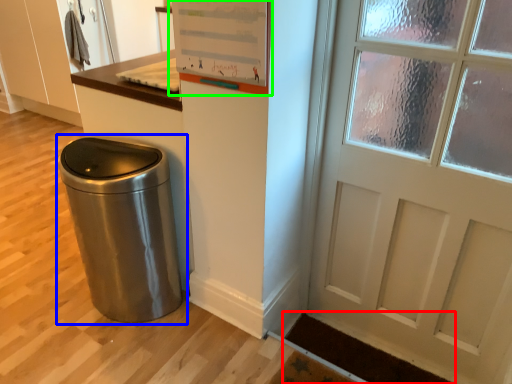
Question: Which is farther away from doormat (highlighted by a red box)? waste container (highlighted by a blue box) or bulletin board (highlighted by a green box)?

Choices:
 (A) waste container
 (B) bulletin board

Answer: (B)